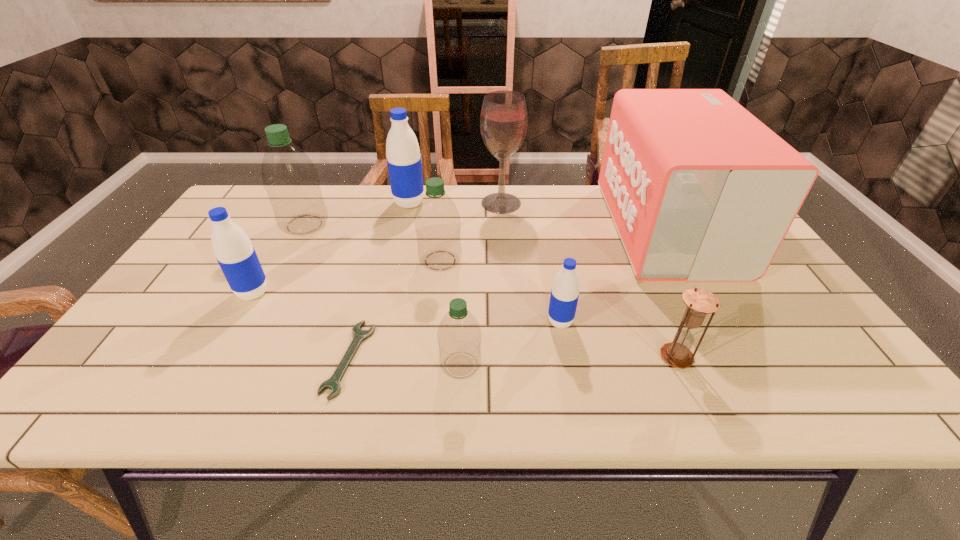
At what (x,y) coordinates should I click in order to perform the action: click on water bottle that is at the near edge. Please return your answer as a coordinate pair (x, y). Looking at the image, I should click on (459, 336).

The height and width of the screenshot is (540, 960). Identify the location of wrench that is at the near edge. (333, 383).

The height and width of the screenshot is (540, 960). What are the coordinates of `object that is at the right edge` in the screenshot? It's located at (699, 189).

The image size is (960, 540). Identify the location of object located at the far right corner. (699, 189).

In order to click on free region at the far edge of the desktop in this screenshot , I will do `click(549, 205)`.

Identify the location of free space at the left edge of the desktop. Image resolution: width=960 pixels, height=540 pixels. (202, 248).

Where is `blank space at the right edge of the desktop`? The height and width of the screenshot is (540, 960). blank space at the right edge of the desktop is located at coordinates (749, 292).

At what (x,y) coordinates should I click in order to perform the action: click on free location at the far left corner. Please return your answer as a coordinate pair (x, y). The image size is (960, 540). Looking at the image, I should click on (236, 204).

Where is `vacant space at the near left corner of the desktop`? vacant space at the near left corner of the desktop is located at coordinates (150, 401).

The height and width of the screenshot is (540, 960). In order to click on vacant area that lies between the second biggest green water bottle and the alcohol in this screenshot , I will do `click(470, 232)`.